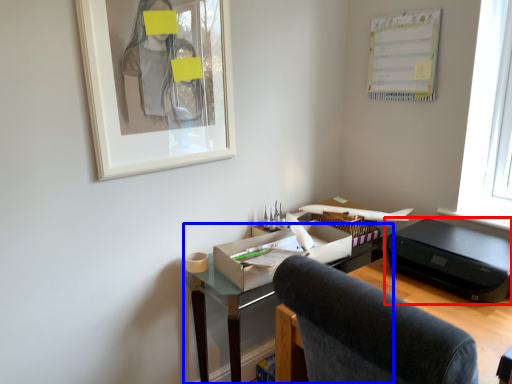
Question: Which of the following is the closest to the observer, printer (highlighted by a red box) or desk (highlighted by a blue box)?

Choices:
 (A) printer
 (B) desk

Answer: (A)